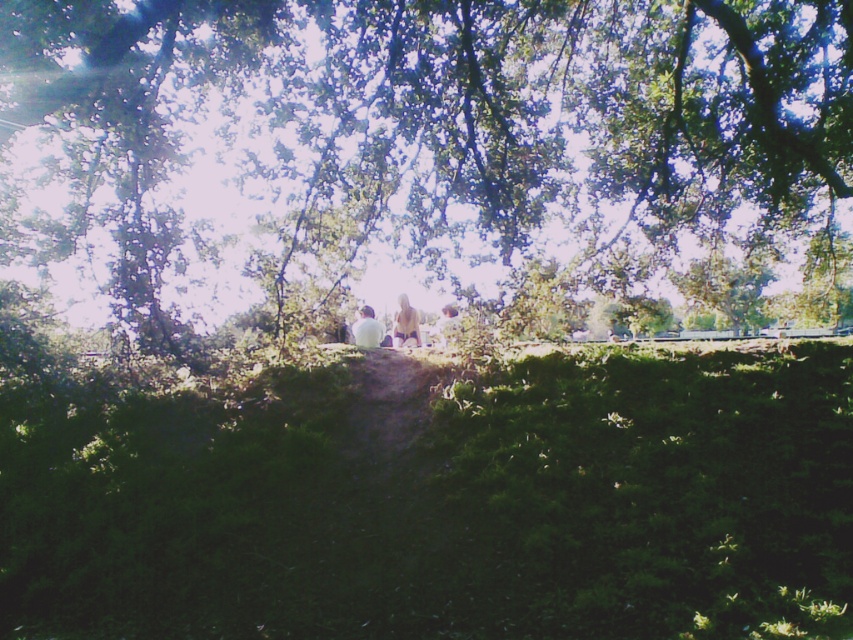
Question: Which point is farther to the camera?

Choices:
 (A) (457, 333)
 (B) (393, 342)
 (C) (136, 227)

Answer: (B)

Question: Based on their relative distances, which object is nearer to the green mossy hedge at upper center?

Choices:
 (A) green leafy tree at center
 (B) light brown fabric person at center
 (C) light brown fabric dress at center

Answer: (A)

Question: Is green mossy hedge at upper center to the right of white matte shirt at center from the viewer's perspective?

Choices:
 (A) yes
 (B) no

Answer: (B)

Question: Can you confirm if green leafy tree at center is positioned above green mossy hedge at upper center?

Choices:
 (A) no
 (B) yes

Answer: (B)

Question: Among these objects, which one is nearest to the camera?

Choices:
 (A) white matte shirt at center
 (B) light brown fabric dress at center

Answer: (B)

Question: From the image, what is the correct spatial relationship of green leafy tree at center in relation to green mossy hedge at upper center?

Choices:
 (A) left
 (B) right

Answer: (A)